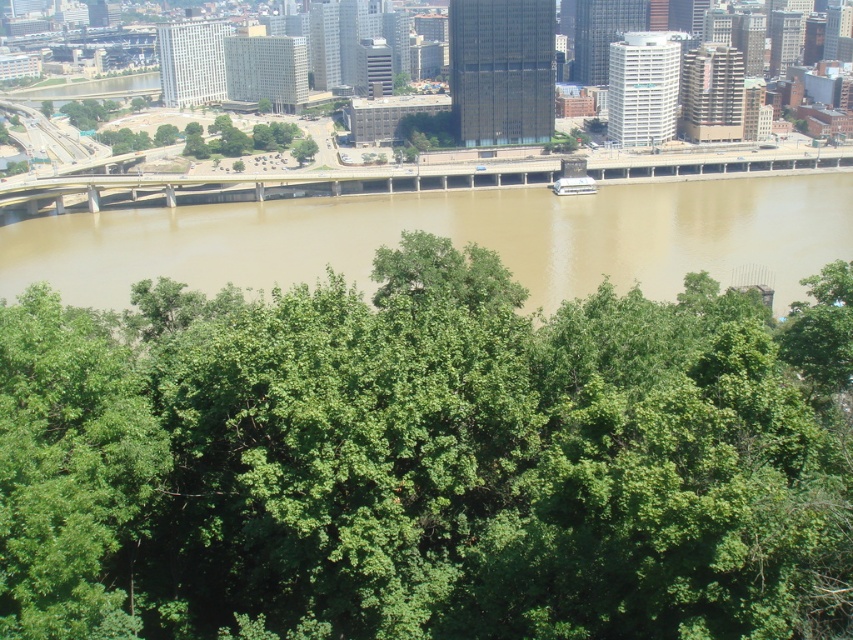
You are standing at the origin point of the coordinate system in the image. The origin is at the bottom left corner of the image. You want to walk towards the green leafy tree at center. In which direction should you move relative to the origin?

The green leafy tree at center is located at coordinates point [427,460]. Since the origin is at the bottom left corner, moving towards the right and slightly upwards would lead you to the green leafy tree at center.

You are a city planner evaluating the flood risk in the area. Based on the image, which of the two objects, the brown muddy water at center or the brown concrete bridge at center, is more likely to be submerged during heavy rainfall, and why?

The brown muddy water at center is more likely to be submerged during heavy rainfall because it has a greater height compared to the brown concrete bridge at center, meaning the water level is already higher than the bridge, so further rainfall could lead to higher submersion.